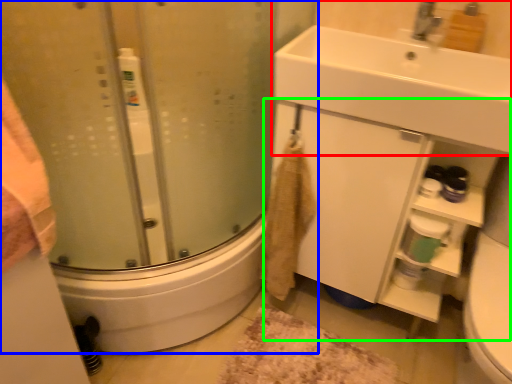
Question: Based on their relative distances, which object is nearer to sink (highlighted by a red box)? Choose from shower door (highlighted by a blue box) and bathroom cabinet (highlighted by a green box).

Choices:
 (A) shower door
 (B) bathroom cabinet

Answer: (B)